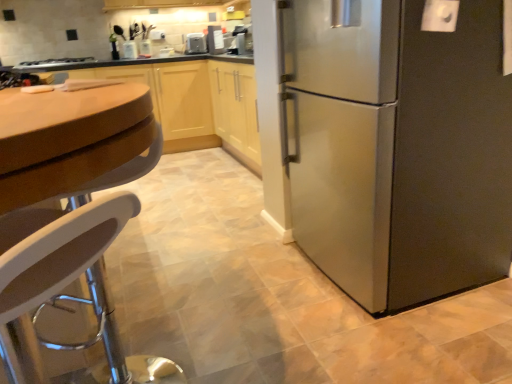
Question: Can you confirm if wooden cabinet at center is positioned to the right of metallic silver toaster at upper center, placed as the second appliance when sorted from right to left?

Choices:
 (A) no
 (B) yes

Answer: (A)

Question: Can you confirm if wooden cabinet at center is taller than metallic silver toaster at upper center, the second appliance positioned from the front?

Choices:
 (A) yes
 (B) no

Answer: (A)

Question: Is wooden cabinet at center touching metallic silver toaster at upper center, placed as the second appliance when sorted from right to left?

Choices:
 (A) yes
 (B) no

Answer: (B)

Question: Considering the relative sizes of wooden cabinet at center and metallic silver toaster at upper center, placed as the second appliance when sorted from right to left, in the image provided, is wooden cabinet at center smaller than metallic silver toaster at upper center, placed as the second appliance when sorted from right to left,?

Choices:
 (A) no
 (B) yes

Answer: (A)

Question: Does wooden cabinet at center have a lesser height compared to metallic silver toaster at upper center, arranged as the first appliance when viewed from the back?

Choices:
 (A) yes
 (B) no

Answer: (B)

Question: From the image's perspective, is wooden cabinet at center positioned above or below metallic silver toaster at upper center, arranged as the first appliance when viewed from the back?

Choices:
 (A) above
 (B) below

Answer: (B)

Question: Based on their sizes in the image, would you say wooden cabinet at center is bigger or smaller than metallic silver toaster at upper center, positioned as the 1th appliance in left-to-right order?

Choices:
 (A) small
 (B) big

Answer: (B)

Question: Relative to metallic silver toaster at upper center, the second appliance positioned from the front, is wooden cabinet at center in front or behind?

Choices:
 (A) behind
 (B) front

Answer: (B)

Question: Considering the positions of wooden cabinet at center and metallic silver toaster at upper center, positioned as the 1th appliance in left-to-right order, in the image, is wooden cabinet at center wider or thinner than metallic silver toaster at upper center, positioned as the 1th appliance in left-to-right order,?

Choices:
 (A) wide
 (B) thin

Answer: (A)

Question: Looking at the image, does satin silver stove at upper left seem bigger or smaller compared to metallic silver toaster at upper center, positioned as the 1th appliance in left-to-right order?

Choices:
 (A) small
 (B) big

Answer: (B)

Question: Based on their positions, is satin silver stove at upper left located to the left or right of metallic silver toaster at upper center, placed as the second appliance when sorted from right to left?

Choices:
 (A) left
 (B) right

Answer: (A)

Question: From the image's perspective, is satin silver stove at upper left located above or below metallic silver toaster at upper center, the second appliance positioned from the front?

Choices:
 (A) above
 (B) below

Answer: (B)

Question: Considering the positions of satin silver stove at upper left and metallic silver toaster at upper center, placed as the second appliance when sorted from right to left, in the image, is satin silver stove at upper left wider or thinner than metallic silver toaster at upper center, placed as the second appliance when sorted from right to left,?

Choices:
 (A) wide
 (B) thin

Answer: (A)

Question: Considering the positions of satin silver refrigerator at right and satin silver stove at upper left in the image, is satin silver refrigerator at right taller or shorter than satin silver stove at upper left?

Choices:
 (A) short
 (B) tall

Answer: (B)

Question: Based on their sizes in the image, would you say satin silver refrigerator at right is bigger or smaller than satin silver stove at upper left?

Choices:
 (A) big
 (B) small

Answer: (A)